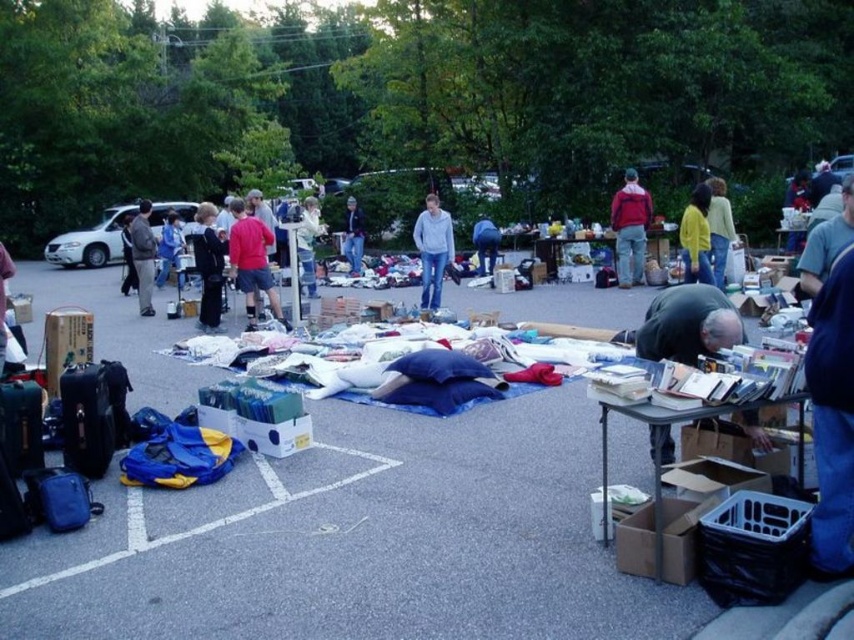
Question: Which of the following is the closest to the observer?

Choices:
 (A) click(299, 228)
 (B) click(212, 304)
 (C) click(477, 232)

Answer: (B)

Question: Which point is closer to the camera?

Choices:
 (A) red jacket at center
 (B) dark gray hair at lower right
 (C) dark gray hoodie at upper left

Answer: (B)

Question: Where is dark gray hair at lower right located in relation to matte black jacket at center in the image?

Choices:
 (A) above
 (B) below

Answer: (B)

Question: Is red jacket at center wider than denim jacket at center?

Choices:
 (A) no
 (B) yes

Answer: (B)

Question: Which point is closer to the camera taking this photo?

Choices:
 (A) (211, 212)
 (B) (110, 228)
 (C) (126, 252)

Answer: (A)

Question: From the image, what is the correct spatial relationship of white cotton shirt at center in relation to blue denim jacket at center?

Choices:
 (A) below
 (B) above

Answer: (A)